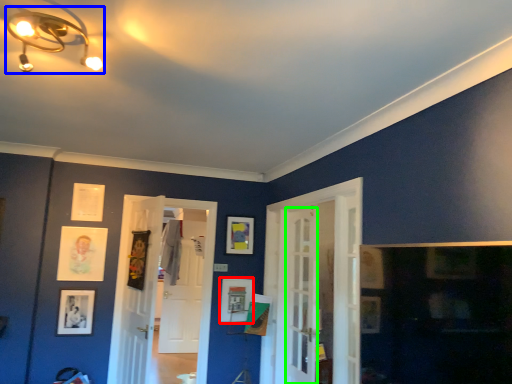
Question: Based on their relative distances, which object is nearer to picture frame (highlighted by a red box)? Choose from light fixture (highlighted by a blue box) and screen door (highlighted by a green box).

Choices:
 (A) light fixture
 (B) screen door

Answer: (B)